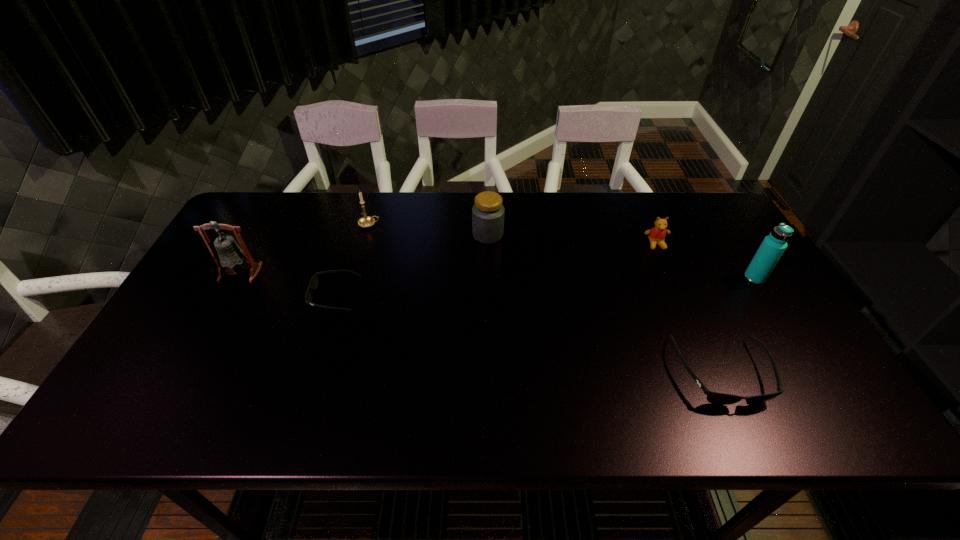
Please point a spot to place another sunglasses for symmetrical spacing. Please provide its 2D coordinates. Your answer should be formatted as a tuple, i.e. [(x, y)], where the tuple contains the x and y coordinates of a point satisfying the conditions above.

[(513, 331)]